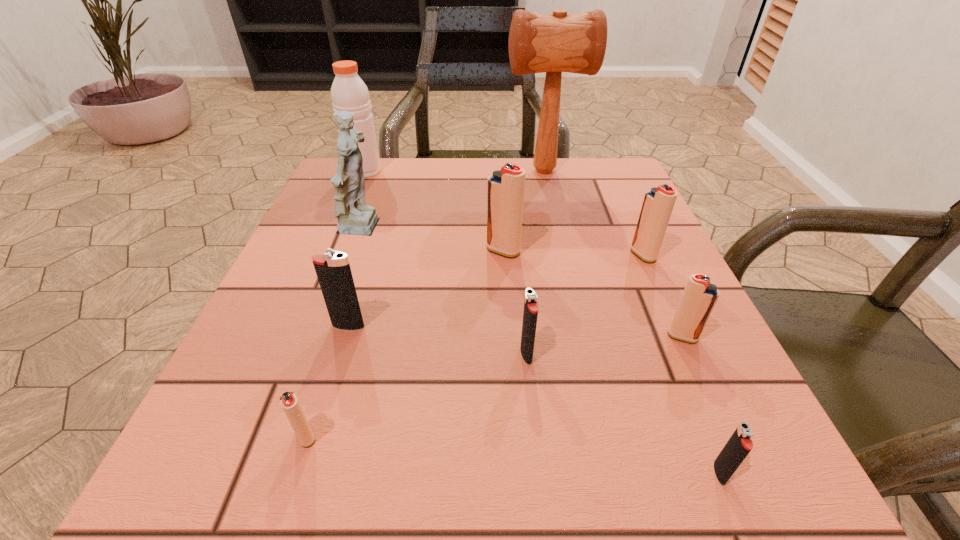
Identify the location of free spot that satisfies the following two spatial constraints: 1. on the front-facing side of the ninth farthest object; 2. on the left side of the figurine. The width and height of the screenshot is (960, 540). (292, 437).

This screenshot has height=540, width=960. In order to click on free location that satisfies the following two spatial constraints: 1. on the front side of the second smallest red igniter; 2. on the left side of the fourth tallest object in this screenshot , I will do `click(509, 336)`.

Find the location of a particular element. This screenshot has height=540, width=960. vacant area in the image that satisfies the following two spatial constraints: 1. on the back side of the biggest black igniter; 2. on the front-facing side of the figurine is located at coordinates (377, 230).

Locate an element on the screen. This screenshot has height=540, width=960. vacant space that satisfies the following two spatial constraints: 1. on the back side of the third smallest red igniter; 2. on the right side of the nearest object is located at coordinates (630, 255).

Image resolution: width=960 pixels, height=540 pixels. In order to click on vacant space that satisfies the following two spatial constraints: 1. on the front-facing side of the figurine; 2. on the back side of the nearest object in this screenshot , I will do `click(279, 472)`.

Locate an element on the screen. The image size is (960, 540). vacant space that satisfies the following two spatial constraints: 1. on the front-facing side of the figurine; 2. on the back side of the smallest red igniter is located at coordinates (292, 437).

The height and width of the screenshot is (540, 960). Find the location of `free space that satisfies the following two spatial constraints: 1. on the front side of the second smallest red igniter; 2. on the right side of the leftmost black igniter`. free space that satisfies the following two spatial constraints: 1. on the front side of the second smallest red igniter; 2. on the right side of the leftmost black igniter is located at coordinates (346, 336).